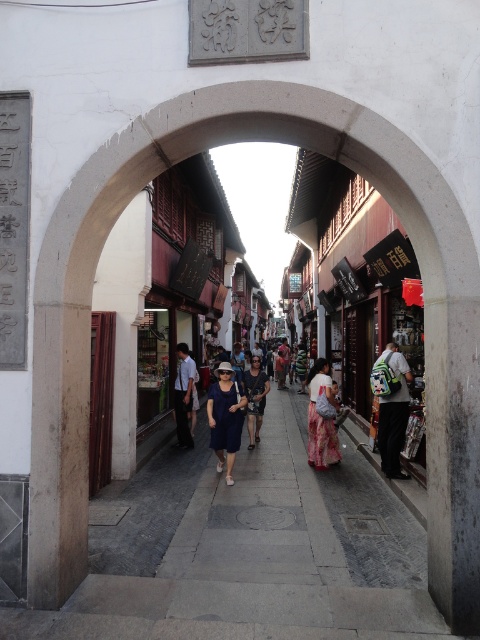
You are standing at the entrance of the arched gateway and see the point marked by coordinates point (x=321, y=419). What is the object located at that point?

The point (x=321, y=419) corresponds to the floral silk dress at center.

You are a photographer standing at the entrance of the arched gateway. You notice two dresses in the crowd at the center of the image. Which dress is taller, the blue cotton dress at center or the floral silk dress at center?

The blue cotton dress at center is much taller than the floral silk dress at center, so the blue cotton dress at center is taller.

In the scene shown: You are standing at the entrance of the arched gateway and notice a blue cotton dress at center. If you walk straight ahead, will the dress come into your direct line of sight?

The blue cotton dress at center is located at point (226,417), which is directly ahead in the center of the scene. Therefore, walking straight ahead would bring the dress into your direct line of sight.